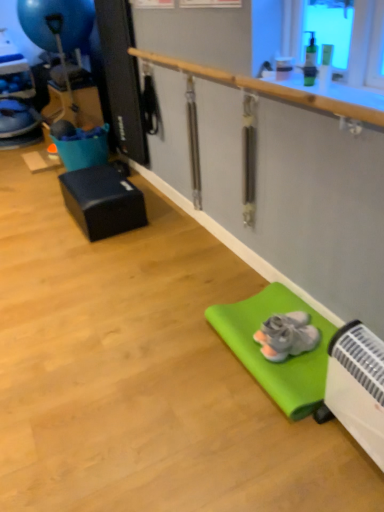
Where is `vacant area that lies in front of black matte cube at left`? The image size is (384, 512). vacant area that lies in front of black matte cube at left is located at coordinates (99, 257).